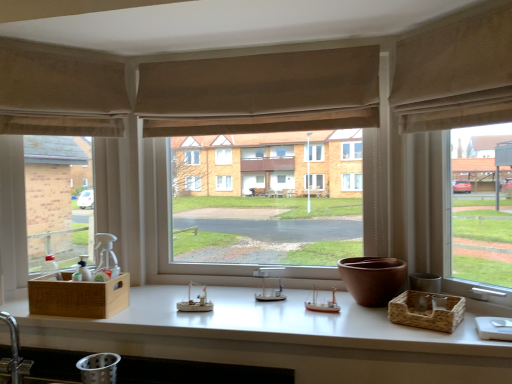
Question: From the image's perspective, is silver metallic faucet at lower left located beneath wooden woven basket at left, which is the first basket from left to right?

Choices:
 (A) no
 (B) yes

Answer: (B)

Question: Considering the relative positions of silver metallic faucet at lower left and wooden woven basket at left, which is counted as the 2th basket, starting from the right, in the image provided, is silver metallic faucet at lower left behind wooden woven basket at left, which is counted as the 2th basket, starting from the right,?

Choices:
 (A) yes
 (B) no

Answer: (B)

Question: Is silver metallic faucet at lower left shorter than wooden woven basket at left, which is counted as the 2th basket, starting from the right?

Choices:
 (A) yes
 (B) no

Answer: (B)

Question: From a real-world perspective, is silver metallic faucet at lower left under wooden woven basket at left, which is the first basket from left to right?

Choices:
 (A) no
 (B) yes

Answer: (B)

Question: Considering the relative sizes of silver metallic faucet at lower left and wooden woven basket at left, which is counted as the 2th basket, starting from the right, in the image provided, is silver metallic faucet at lower left smaller than wooden woven basket at left, which is counted as the 2th basket, starting from the right,?

Choices:
 (A) no
 (B) yes

Answer: (B)

Question: Does silver metallic faucet at lower left have a greater height compared to wooden woven basket at left, which is the first basket from left to right?

Choices:
 (A) no
 (B) yes

Answer: (B)

Question: Is brown woven basket at right, the 2th basket from the left, at the left side of beige fabric curtain at upper right, placed as the second curtain when sorted from left to right?

Choices:
 (A) yes
 (B) no

Answer: (A)

Question: Considering the relative positions of brown woven basket at right, the 2th basket from the left, and beige fabric curtain at upper right, which appears as the 2th curtain when viewed from the back, in the image provided, is brown woven basket at right, the 2th basket from the left, behind beige fabric curtain at upper right, which appears as the 2th curtain when viewed from the back,?

Choices:
 (A) yes
 (B) no

Answer: (A)

Question: Is brown woven basket at right, the 2th basket from the left, aimed at beige fabric curtain at upper right, arranged as the first curtain when viewed from the right?

Choices:
 (A) yes
 (B) no

Answer: (B)

Question: Can we say brown woven basket at right, which is the 1th basket from right to left, lies outside beige fabric curtain at upper right, the 1th curtain when ordered from front to back?

Choices:
 (A) yes
 (B) no

Answer: (A)

Question: From a real-world perspective, is brown woven basket at right, the 2th basket from the left, on top of beige fabric curtain at upper right, which appears as the 2th curtain when viewed from the back?

Choices:
 (A) yes
 (B) no

Answer: (B)

Question: Is brown woven basket at right, which is the 1th basket from right to left, thinner than beige fabric curtain at upper right, the 1th curtain when ordered from front to back?

Choices:
 (A) no
 (B) yes

Answer: (A)

Question: Is brown woven basket at right, which is the 1th basket from right to left, thinner than white matte countertop at center?

Choices:
 (A) yes
 (B) no

Answer: (A)